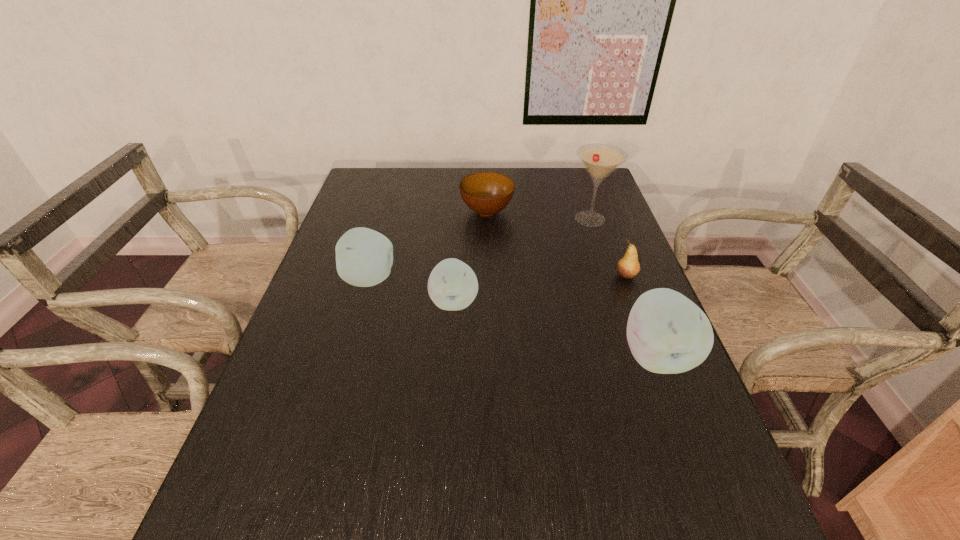
Where is `free space at the left edge of the desktop`? free space at the left edge of the desktop is located at coordinates (323, 265).

The image size is (960, 540). I want to click on vacant space at the right edge, so (606, 292).

In the image, there is a desktop. In order to click on vacant space at the far left corner in this screenshot , I will do `click(400, 185)`.

The height and width of the screenshot is (540, 960). In the image, there is a desktop. Identify the location of free space at the far right corner. (575, 173).

Locate an element on the screen. vacant area that lies between the tallest object and the shortest apple is located at coordinates (522, 260).

Locate an element on the screen. The height and width of the screenshot is (540, 960). vacant point located between the second tallest apple and the pear is located at coordinates (498, 278).

Find the location of `unoccupied area between the nearest apple and the tallest object`. unoccupied area between the nearest apple and the tallest object is located at coordinates (623, 287).

Where is `vacant space that's between the second apple from right to left and the leftmost object`? Image resolution: width=960 pixels, height=540 pixels. vacant space that's between the second apple from right to left and the leftmost object is located at coordinates (412, 291).

Locate an element on the screen. This screenshot has height=540, width=960. vacant space that is in between the rightmost apple and the tallest object is located at coordinates (623, 287).

At what (x,y) coordinates should I click in order to perform the action: click on vacant space that is in between the nearest apple and the second apple from left to right. Please return your answer as a coordinate pair (x, y). The image size is (960, 540). Looking at the image, I should click on click(555, 328).